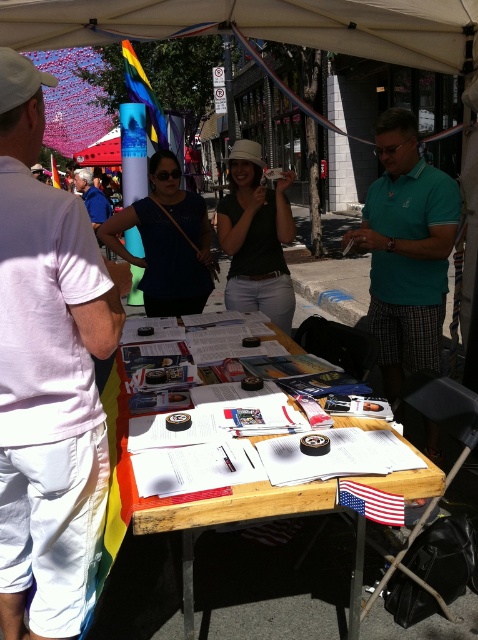
Question: Which object is the farthest from the american flag at center?

Choices:
 (A) rainbow fabric flag at upper left
 (B) white cotton shirt at left
 (C) matte black shirt at center

Answer: (A)

Question: Which object is positioned farthest from the rainbow fabric flag at upper left?

Choices:
 (A) wooden table at center
 (B) teal polo shirt at center
 (C) matte black shirt at center

Answer: (A)

Question: Based on their relative distances, which object is farther from the matte black shirt at center?

Choices:
 (A) american flag at center
 (B) white cotton shirt at left
 (C) wooden table at center
 (D) rainbow fabric flag at upper left

Answer: (D)

Question: Is matte black shirt at center above american flag at center?

Choices:
 (A) yes
 (B) no

Answer: (A)

Question: Is teal polo shirt at center wider than matte black shirt at center?

Choices:
 (A) yes
 (B) no

Answer: (A)

Question: Is white cotton shirt at left closer to camera compared to american flag at center?

Choices:
 (A) no
 (B) yes

Answer: (B)